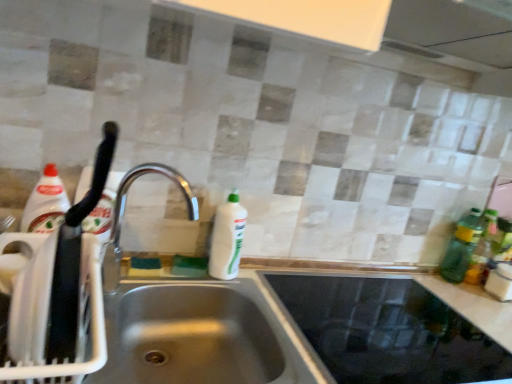
Find the location of `vacant area that lies in front of white glossy bottle at center`. vacant area that lies in front of white glossy bottle at center is located at coordinates (222, 284).